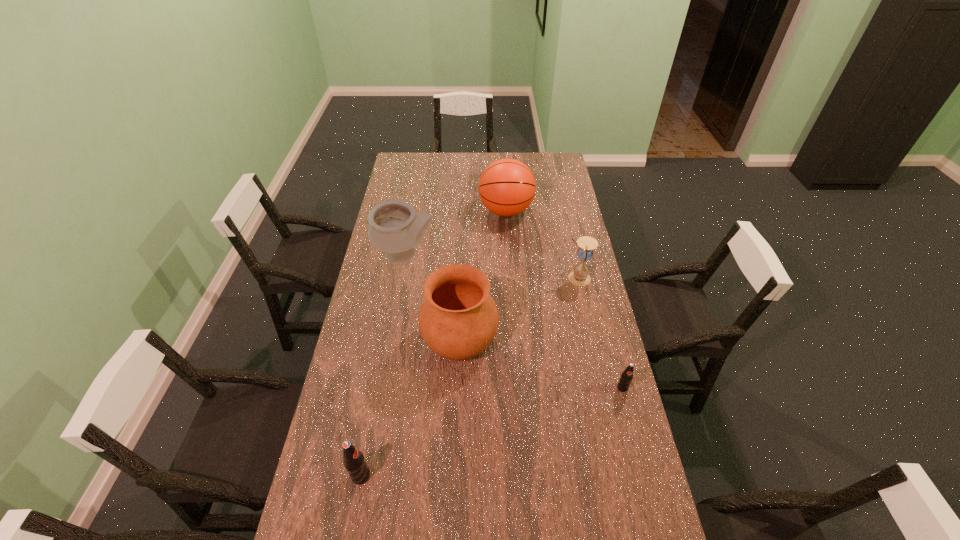
To make them evenly spaced by inserting another pop_(soda) among them, please locate a vacant spot for this new pop_(soda). Please provide its 2D coordinates. Your answer should be formatted as a tuple, i.e. [(x, y)], where the tuple contains the x and y coordinates of a point satisfying the conditions above.

[(501, 428)]